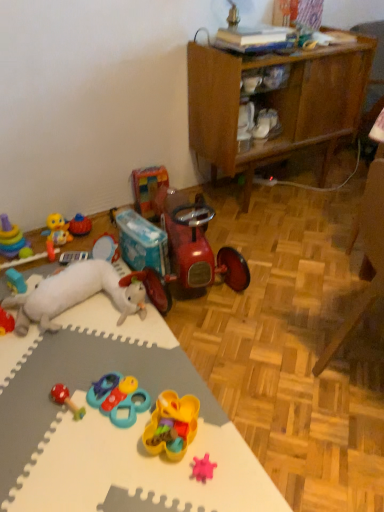
Locate an element on the screen. free spot to the right of rubberized red and green toy at lower left, the 7th toy from the left is located at coordinates (124, 415).